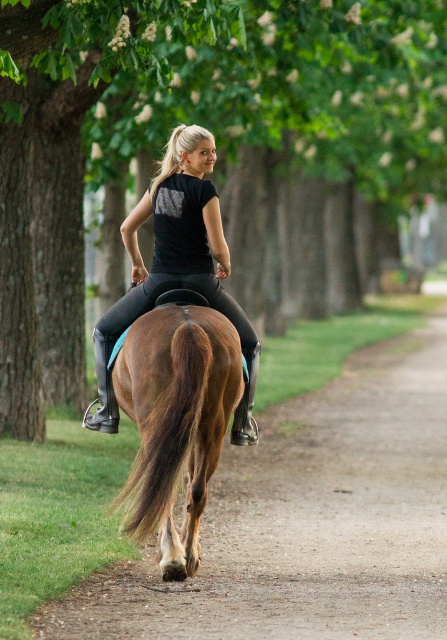
Can you confirm if brown leather horse at center is positioned below brown glossy horse at center?

Yes.

Which is more to the left, brown leather horse at center or brown glossy horse at center?

brown glossy horse at center

This screenshot has width=447, height=640. Describe the element at coordinates (307, 520) in the screenshot. I see `brown leather horse at center` at that location.

Find the location of `brown leather horse at center`. brown leather horse at center is located at coordinates (307, 520).

Can you confirm if green leafy tree at center is taller than brown glossy horse at center?

Yes.

How distant is green leafy tree at center from brown glossy horse at center?

green leafy tree at center is 6.72 meters from brown glossy horse at center.

Image resolution: width=447 pixels, height=640 pixels. What do you see at coordinates (313, 138) in the screenshot? I see `green leafy tree at center` at bounding box center [313, 138].

Locate an element on the screen. This screenshot has height=640, width=447. green leafy tree at center is located at coordinates (313, 138).

Based on the photo, does brown leather horse at center have a larger size compared to black matte riding pants at center?

Yes.

Is brown leather horse at center to the right of black matte riding pants at center from the viewer's perspective?

Indeed, brown leather horse at center is positioned on the right side of black matte riding pants at center.

Measure the distance between brown leather horse at center and camera.

brown leather horse at center is 22.18 feet from camera.

This screenshot has width=447, height=640. Identify the location of brown leather horse at center. (307, 520).